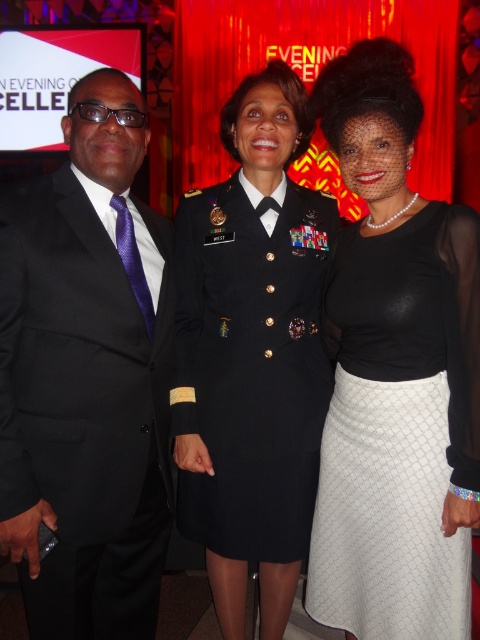
Question: Which point appears farthest from the camera in this image?

Choices:
 (A) (276, 387)
 (B) (368, 451)
 (C) (101, 616)

Answer: (A)

Question: Is shiny black dress at center positioned before white textured skirt at right?

Choices:
 (A) yes
 (B) no

Answer: (B)

Question: Which object appears farthest from the camera in this image?

Choices:
 (A) black satin suit at left
 (B) shiny black dress at center

Answer: (B)

Question: Which point is farther to the camera?

Choices:
 (A) (68, 396)
 (B) (321, 355)
 (C) (469, 477)

Answer: (B)

Question: Can you confirm if black satin suit at left is wider than white textured skirt at right?

Choices:
 (A) yes
 (B) no

Answer: (B)

Question: Is black satin suit at left closer to the viewer compared to white textured skirt at right?

Choices:
 (A) yes
 (B) no

Answer: (A)